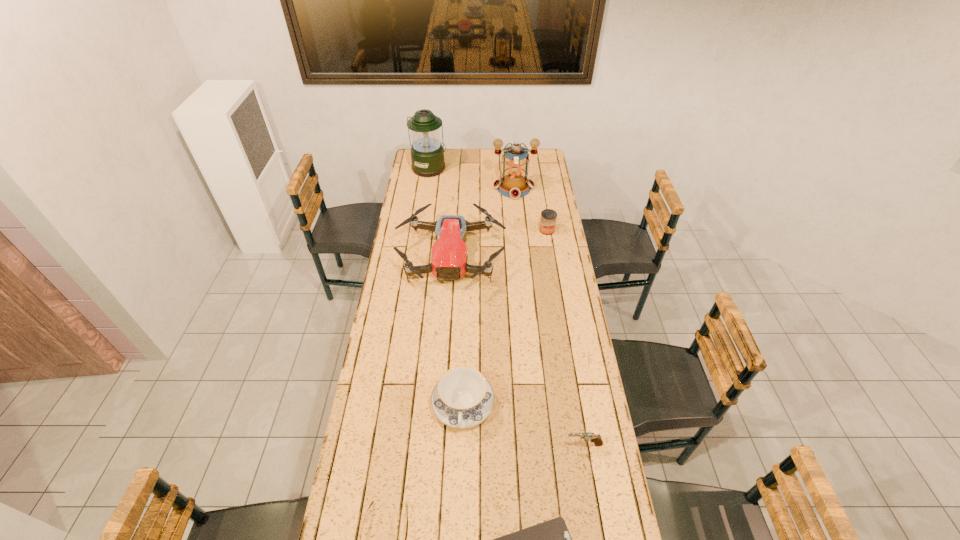
Find the location of a particular element. This screenshot has height=540, width=960. the left lantern is located at coordinates (427, 153).

At what (x,y) coordinates should I click in order to perform the action: click on the right lantern. Please return your answer as a coordinate pair (x, y). Looking at the image, I should click on (514, 184).

Where is `the sixth shortest object`? the sixth shortest object is located at coordinates (449, 256).

This screenshot has width=960, height=540. What are the coordinates of `chinaware` in the screenshot? It's located at (462, 398).

I want to click on can, so click(548, 218).

Find the location of a particular element. pistol is located at coordinates coord(597,439).

This screenshot has width=960, height=540. Find the location of `the third nearest object`. the third nearest object is located at coordinates (597, 439).

Locate an element on the screen. blank space located 0.170m on the front of the left lantern is located at coordinates tap(425, 196).

Where is `free space located 0.310m on the front-facing side of the right lantern`? free space located 0.310m on the front-facing side of the right lantern is located at coordinates (518, 239).

The image size is (960, 540). I want to click on vacant area situated on the front-facing side of the drone, so click(x=444, y=372).